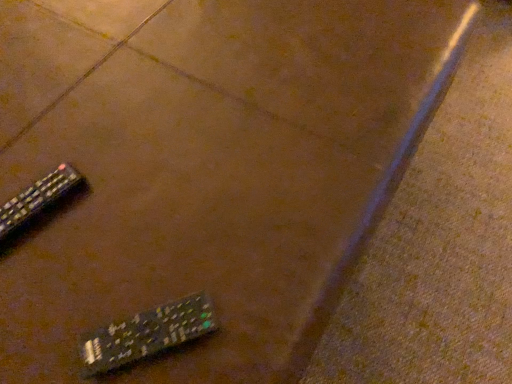
The width and height of the screenshot is (512, 384). What are the coordinates of `free space between black plastic remote at lower left, the 1th remote control in the left-to-right sequence, and black plastic remote at lower left, which appears as the 2th remote control when viewed from the left` in the screenshot? It's located at (91, 263).